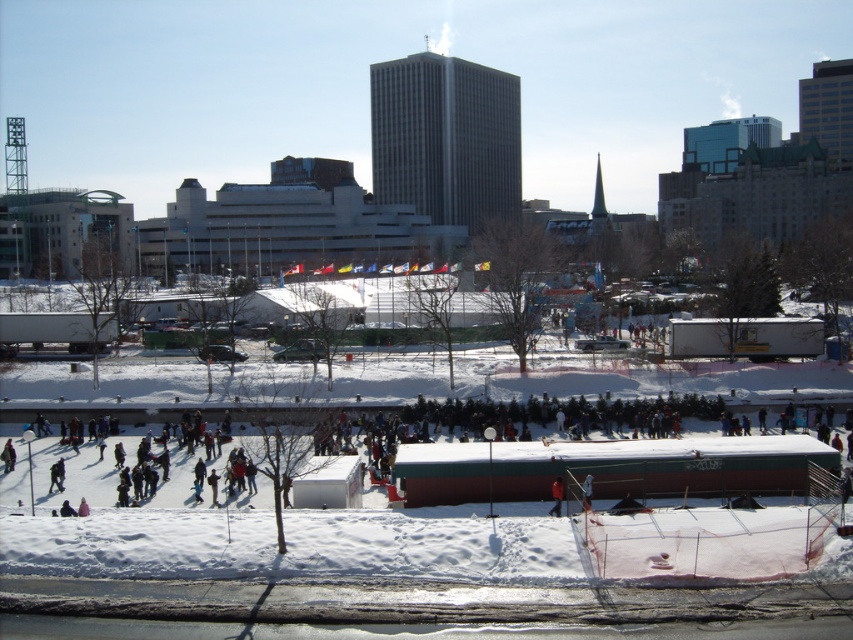
Question: Is dark gray snowboarder at center to the left of orange fabric at center from the viewer's perspective?

Choices:
 (A) yes
 (B) no

Answer: (A)

Question: Is dark gray snowboarder at center above orange fabric at center?

Choices:
 (A) no
 (B) yes

Answer: (B)

Question: Is dark gray snowboarder at center bigger than orange fabric at center?

Choices:
 (A) yes
 (B) no

Answer: (A)

Question: Which point is farther to the camera?

Choices:
 (A) dark gray snowboarder at center
 (B) orange fabric at center

Answer: (B)

Question: Which point is closer to the camera?

Choices:
 (A) (598, 477)
 (B) (560, 513)

Answer: (B)